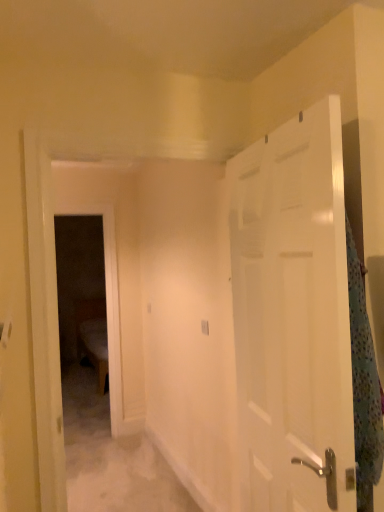
Question: Does white glossy door at right have a greater height compared to fluffy polka dot blanket at right?

Choices:
 (A) no
 (B) yes

Answer: (B)

Question: Can fluffy polka dot blanket at right be found inside white glossy door at right?

Choices:
 (A) no
 (B) yes

Answer: (A)

Question: Is white glossy door at right positioned far away from fluffy polka dot blanket at right?

Choices:
 (A) no
 (B) yes

Answer: (A)

Question: Does white glossy door at right have a lesser width compared to fluffy polka dot blanket at right?

Choices:
 (A) yes
 (B) no

Answer: (B)

Question: From a real-world perspective, is white glossy door at right on fluffy polka dot blanket at right?

Choices:
 (A) yes
 (B) no

Answer: (A)

Question: From a real-world perspective, is white glossy door at right located beneath fluffy polka dot blanket at right?

Choices:
 (A) no
 (B) yes

Answer: (A)

Question: Considering the relative positions of fluffy polka dot blanket at right and white glossy door at right in the image provided, is fluffy polka dot blanket at right to the right of white glossy door at right from the viewer's perspective?

Choices:
 (A) no
 (B) yes

Answer: (B)

Question: Can you confirm if fluffy polka dot blanket at right is wider than white glossy door at right?

Choices:
 (A) yes
 (B) no

Answer: (B)

Question: From the image's perspective, is fluffy polka dot blanket at right above white glossy door at right?

Choices:
 (A) yes
 (B) no

Answer: (A)

Question: Is the surface of fluffy polka dot blanket at right in direct contact with white glossy door at right?

Choices:
 (A) yes
 (B) no

Answer: (B)

Question: Considering the relative positions of fluffy polka dot blanket at right and white glossy door at right in the image provided, is fluffy polka dot blanket at right in front of white glossy door at right?

Choices:
 (A) no
 (B) yes

Answer: (A)

Question: Can you confirm if fluffy polka dot blanket at right is bigger than white glossy door at right?

Choices:
 (A) yes
 (B) no

Answer: (B)

Question: Considering the positions of white glossy door at right and fluffy polka dot blanket at right in the image, is white glossy door at right bigger or smaller than fluffy polka dot blanket at right?

Choices:
 (A) big
 (B) small

Answer: (A)